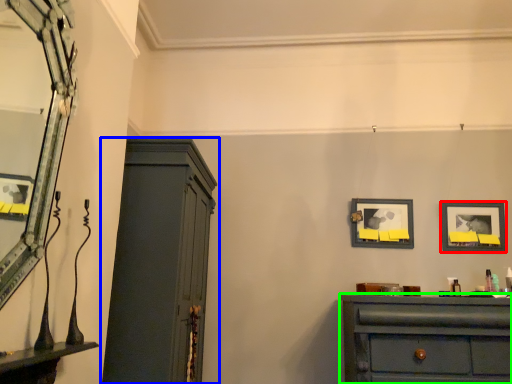
Question: Estimate the real-world distances between objects in this image. Which object is closer to picture frame (highlighted by a red box), cupboard (highlighted by a blue box) or chest of drawers (highlighted by a green box)?

Choices:
 (A) cupboard
 (B) chest of drawers

Answer: (B)